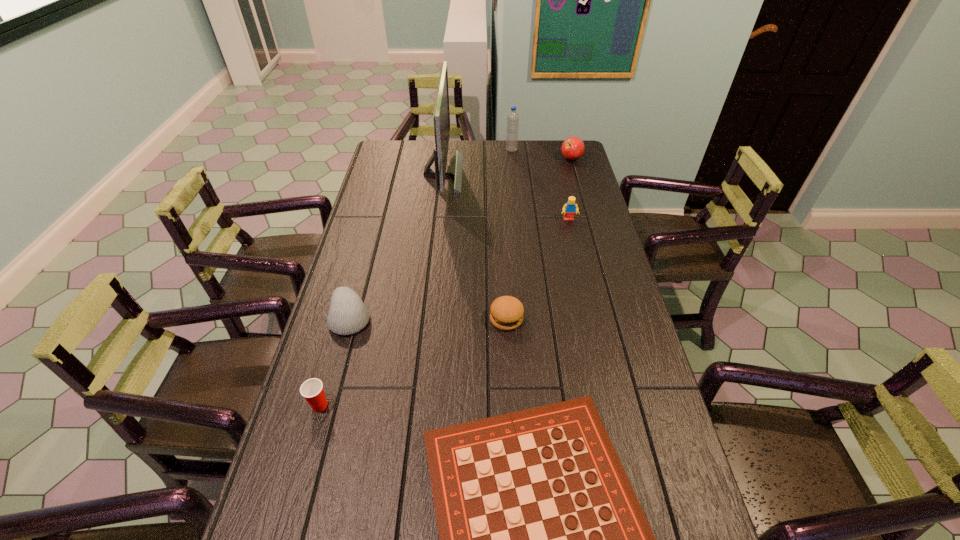
At what (x,y) coordinates should I click in order to perform the action: click on free point between the water bottle and the Dixie cup. Please return your answer as a coordinate pair (x, y). The width and height of the screenshot is (960, 540). Looking at the image, I should click on (416, 278).

Where is `vacant area between the apple and the Dixie cup`? vacant area between the apple and the Dixie cup is located at coordinates (445, 282).

Where is `the fifth closest object to the gameboard`? the fifth closest object to the gameboard is located at coordinates (441, 115).

Identify which object is located as the third nearest to the hamburger. Please provide its 2D coordinates. Your answer should be formatted as a tuple, i.e. [(x, y)], where the tuple contains the x and y coordinates of a point satisfying the conditions above.

[(569, 209)]

Identify the location of free space that satisfies the following two spatial constraints: 1. on the back side of the beanie; 2. on the left side of the Dixie cup. (345, 318).

What are the coordinates of `free space that satisfies the following two spatial constraints: 1. on the back side of the apple; 2. on the left side of the Dixie cup` in the screenshot? It's located at (389, 159).